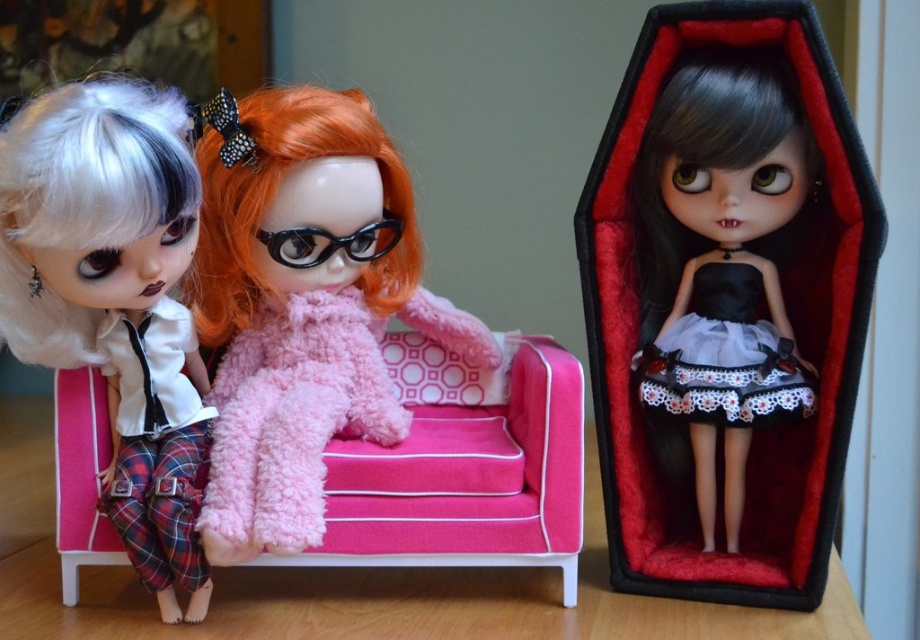
Question: Is black satin doll at center to the left of pink plush couch at left from the viewer's perspective?

Choices:
 (A) yes
 (B) no

Answer: (B)

Question: Based on their relative distances, which object is farther from the black lace dress at center?

Choices:
 (A) matte white doll at left
 (B) pink plush couch at left
 (C) fuzzy pink dress at center

Answer: (A)

Question: Considering the real-world distances, which object is farthest from the black glossy glasses at center?

Choices:
 (A) pink plush couch at left
 (B) black lace dress at center
 (C) fuzzy pink dress at center

Answer: (B)

Question: Among these objects, which one is nearest to the camera?

Choices:
 (A) fluffy pink coat at center
 (B) black lace dress at center

Answer: (A)

Question: Can you confirm if matte white doll at left is positioned above black lace dress at center?

Choices:
 (A) yes
 (B) no

Answer: (A)

Question: Does black satin doll at center have a smaller size compared to fuzzy pink dress at center?

Choices:
 (A) no
 (B) yes

Answer: (A)